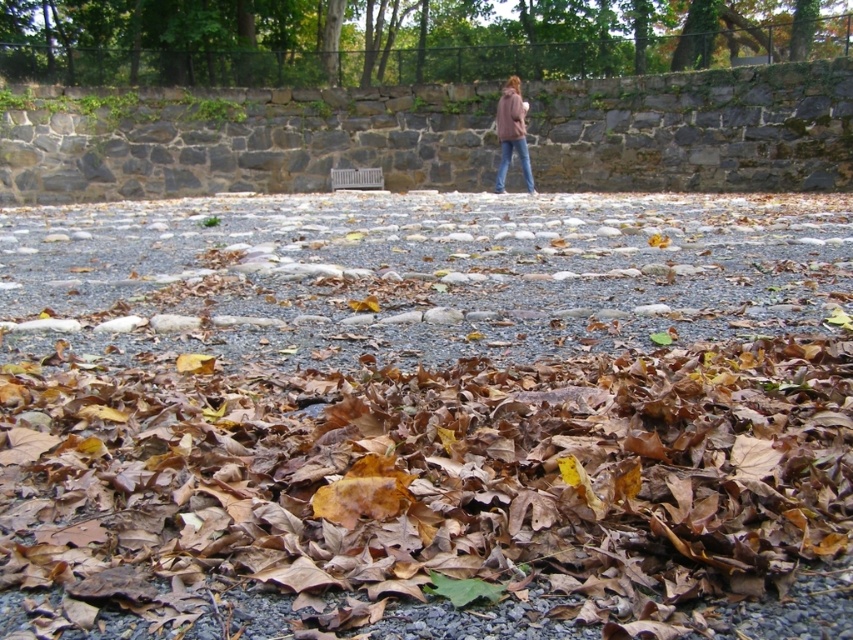
Can you confirm if brown dried leaves at center is positioned to the left of blue jeans at center?

Indeed, brown dried leaves at center is positioned on the left side of blue jeans at center.

Where is `brown dried leaves at center`? This screenshot has height=640, width=853. brown dried leaves at center is located at coordinates pyautogui.click(x=430, y=493).

Is brown leaf litter at upper center thinner than blue jeans at center?

In fact, brown leaf litter at upper center might be wider than blue jeans at center.

This screenshot has width=853, height=640. Describe the element at coordinates (397, 38) in the screenshot. I see `brown leaf litter at upper center` at that location.

Find the location of a particular element. brown leaf litter at upper center is located at coordinates (397, 38).

Is point (105, 448) behind point (590, 36)?

That is False.

Who is taller, brown dried leaves at center or brown leaf litter at upper center?

With more height is brown leaf litter at upper center.

Between point (148, 493) and point (308, 74), which one is positioned in front?

Point (148, 493)

Where is `brown dried leaves at center`? brown dried leaves at center is located at coordinates click(x=430, y=493).